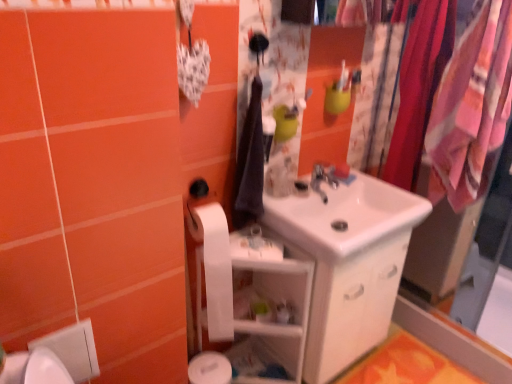
Question: Is white glossy sink at center situated inside dark blue fabric at center or outside?

Choices:
 (A) inside
 (B) outside

Answer: (B)

Question: From a real-world perspective, is white glossy sink at center above or below dark blue fabric at center?

Choices:
 (A) above
 (B) below

Answer: (B)

Question: Which of these objects is positioned farthest from the orange fabric bath mat at lower right?

Choices:
 (A) dark blue fabric at center
 (B) white matte toilet paper at lower left
 (C) white glossy shelf at center
 (D) silky pink fabric at right, which ranks as the second clothesline in right-to-left order
 (E) silver metallic faucet at center

Answer: (A)

Question: Which of these objects is positioned farthest from the silver metallic faucet at center?

Choices:
 (A) white glossy shelf at center
 (B) white glossy sink at center
 (C) orange fabric bath mat at lower right
 (D) silky pink fabric at right, which ranks as the second clothesline in right-to-left order
 (E) dark blue fabric at center

Answer: (C)